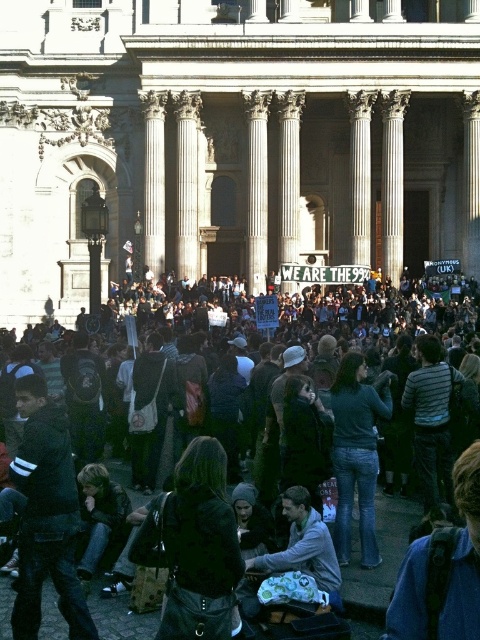
Question: Considering the real-world distances, which object is farthest from the dark blue jeans at center?

Choices:
 (A) dark gray fabric crowd at center
 (B) black leather jacket at center

Answer: (B)

Question: Which point is closer to the camera?

Choices:
 (A) (264, 557)
 (B) (419, 280)
 (C) (200, 628)

Answer: (C)

Question: Which point appears closest to the camera in this image?

Choices:
 (A) (374, 484)
 (B) (315, 330)
 (C) (180, 564)

Answer: (C)

Question: Does black leather jacket at center have a greater width compared to gray fabric jacket at center?

Choices:
 (A) no
 (B) yes

Answer: (B)

Question: Is black leather jacket at center wider than gray fabric jacket at center?

Choices:
 (A) yes
 (B) no

Answer: (A)

Question: Does dark gray fabric crowd at center lie in front of black leather jacket at center?

Choices:
 (A) yes
 (B) no

Answer: (B)